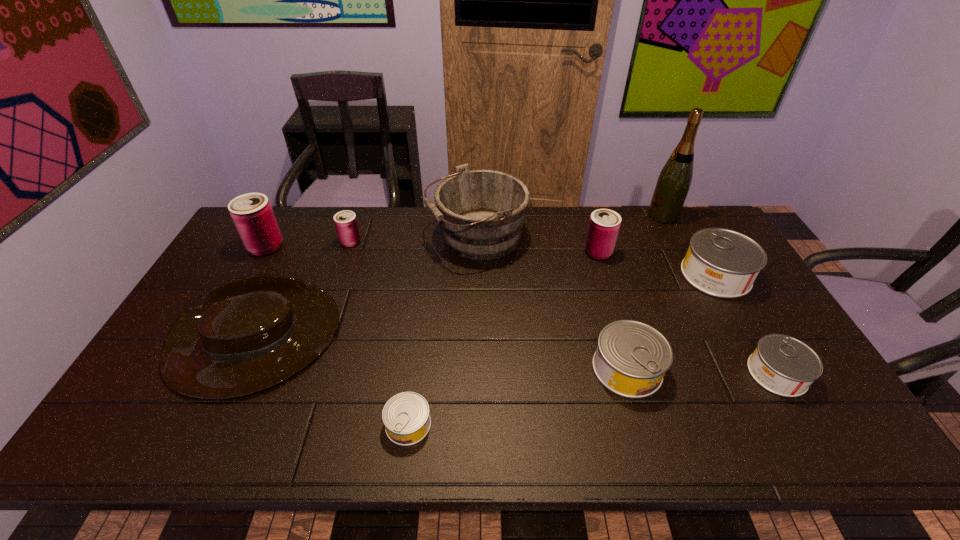
Where is `object situated at the near edge`? The image size is (960, 540). object situated at the near edge is located at coordinates coord(406,416).

Where is `can that is at the left edge`? The height and width of the screenshot is (540, 960). can that is at the left edge is located at coordinates (252, 214).

Where is `cowboy hat that is at the left edge`? cowboy hat that is at the left edge is located at coordinates tap(249, 334).

This screenshot has width=960, height=540. I want to click on wine bottle positioned at the right edge, so click(675, 178).

Identify the location of object present at the far left corner. The image size is (960, 540). (252, 214).

The image size is (960, 540). In order to click on object present at the far right corner in this screenshot , I will do `click(675, 178)`.

The height and width of the screenshot is (540, 960). In the image, there is a desktop. Find the location of `vacant area at the far edge`. vacant area at the far edge is located at coordinates (372, 217).

In order to click on free region at the near edge of the desktop in this screenshot , I will do `click(636, 419)`.

You are a GUI agent. You are given a task and a screenshot of the screen. Output one action in this format:
    pyautogui.click(x=<x>, y=<y>)
    Task: Click on the free location at the right edge of the desktop
    This screenshot has height=540, width=960.
    Given the screenshot: What is the action you would take?
    pyautogui.click(x=752, y=345)

Find the location of a particular element. The width and height of the screenshot is (960, 540). vacant area between the cowboy hat and the smallest silver can is located at coordinates (330, 384).